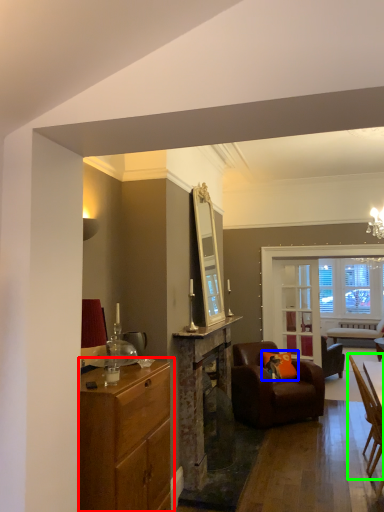
Question: Considering the real-world distances, which object is closest to cabinetry (highlighted by a red box)? pillow (highlighted by a blue box) or chair (highlighted by a green box).

Choices:
 (A) pillow
 (B) chair

Answer: (B)